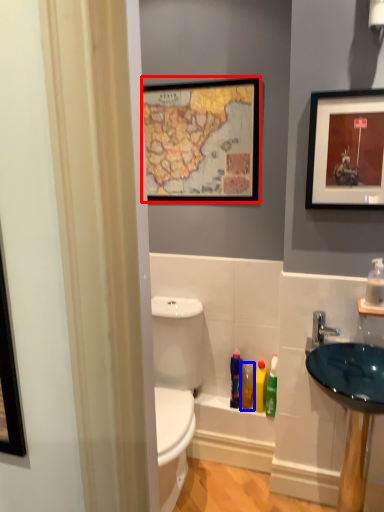
Question: Which point is closer to the camera, picture frame (highlighted by a red box) or toiletry (highlighted by a blue box)?

Choices:
 (A) picture frame
 (B) toiletry

Answer: (A)